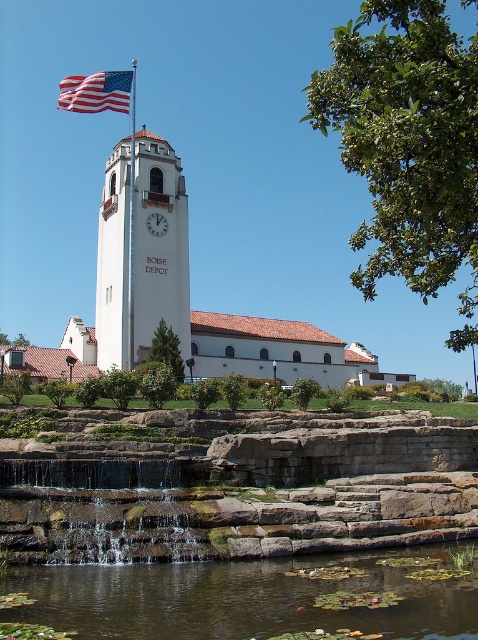
Looking at this image, you are standing in front of the Boise Depot and want to take a photo that includes both the white smooth clock tower at center and the metallic flagpole at upper left. Which object will appear closer to you in the photo?

The white smooth clock tower at center will appear closer because it is positioned closer to the viewer than the metallic flagpole at upper left.

You are a tourist visiting the Boise Depot and want to take a photo that includes both the white smooth clock tower at center and the metallic flagpole at upper left. Based on their heights, which object should appear shorter in your photo?

The white smooth clock tower at center should appear shorter in the photo because it has a lesser height compared to the metallic flagpole at upper left.

You are standing in front of the Boise Depot and want to know if the transparent water at lower center is wider than the white matte clock at center. Can you confirm this based on the scene?

The transparent water at lower center is wider than the white matte clock at center according to the description.